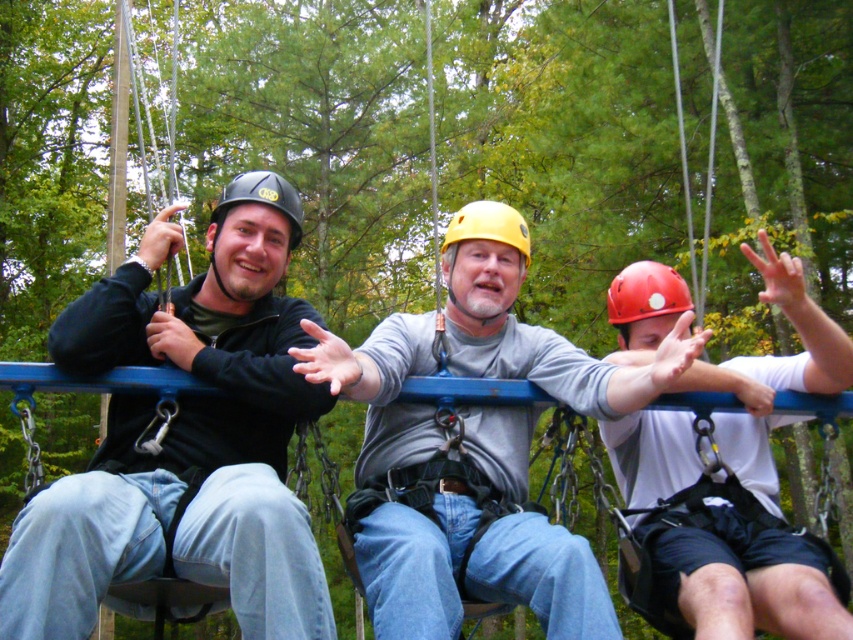
Is gray matte helmet at center below red matte helmet at center?

Yes, gray matte helmet at center is below red matte helmet at center.

Between point (548, 554) and point (672, 307), which one is positioned in front?

Point (548, 554) is in front.

The height and width of the screenshot is (640, 853). I want to click on gray matte helmet at center, so click(x=477, y=547).

I want to click on gray matte helmet at center, so click(477, 547).

Which of these two, gray matte helmet at center or yellow matte helmet at center, stands taller?

gray matte helmet at center

Consider the image. Is gray matte helmet at center to the right of yellow matte helmet at center from the viewer's perspective?

Incorrect, gray matte helmet at center is not on the right side of yellow matte helmet at center.

Is point (381, 548) closer to viewer compared to point (521, 224)?

Yes, point (381, 548) is in front of point (521, 224).

In order to click on gray matte helmet at center in this screenshot , I will do `click(477, 547)`.

Does matte black helmet at center appear over gray matte helmet at center?

Yes, matte black helmet at center is above gray matte helmet at center.

Does matte black helmet at center have a greater width compared to gray matte helmet at center?

No, matte black helmet at center is not wider than gray matte helmet at center.

You are a GUI agent. You are given a task and a screenshot of the screen. Output one action in this format:
    pyautogui.click(x=<x>, y=<y>)
    Task: Click on the matte black helmet at center
    The image size is (853, 640).
    Given the screenshot: What is the action you would take?
    pyautogui.click(x=184, y=438)